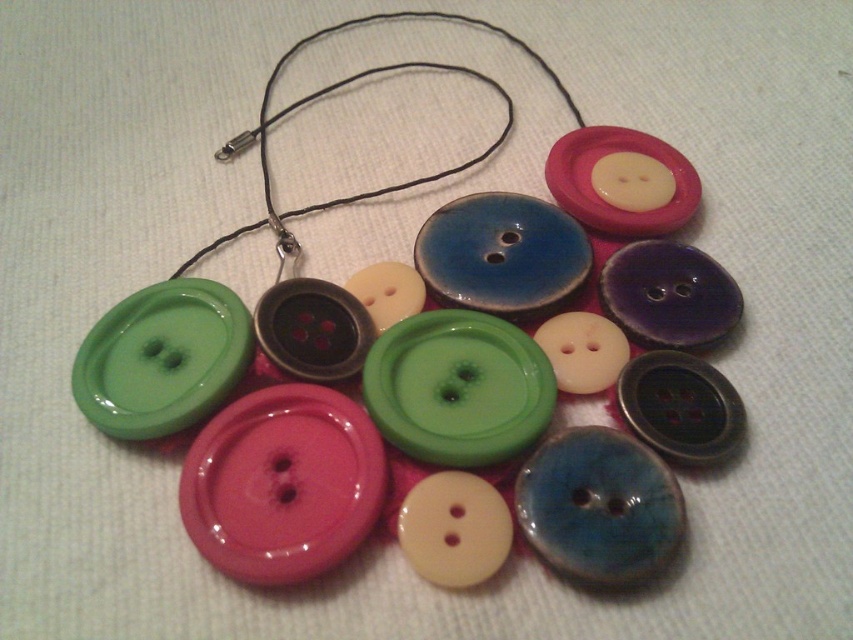
You are a jeweler designing a necklace and need to know the spatial relationship between the glossy plastic buttons at center and the black cord at upper center. Which object is positioned to the right of the other?

The glossy plastic buttons at center is to the right of black cord at upper center.